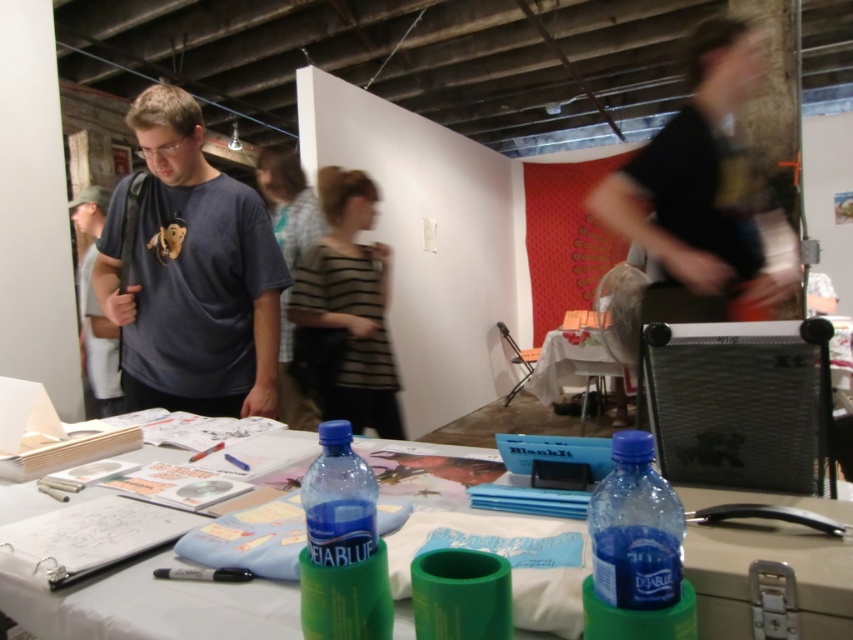
Question: Which point is closer to the camera taking this photo?

Choices:
 (A) (115, 342)
 (B) (538, 356)
 (C) (683, 113)
 (D) (614, 625)

Answer: (D)

Question: Does striped fabric shirt at center lie in front of blue plastic water bottle at center?

Choices:
 (A) yes
 (B) no

Answer: (B)

Question: Is striped fabric shirt at center smaller than blue plastic water bottle at center?

Choices:
 (A) no
 (B) yes

Answer: (A)

Question: Which object is the farthest from the blue translucent bottle at center?

Choices:
 (A) dark gray t-shirt at center
 (B) striped fabric shirt at center
 (C) translucent plastic table at center

Answer: (B)

Question: Does black matte shirt at upper right lie in front of striped fabric shirt at center?

Choices:
 (A) no
 (B) yes

Answer: (B)

Question: Which point is farther from the camera taking this photo?

Choices:
 (A) (82, 330)
 (B) (798, 499)
 (C) (552, 374)
 (D) (328, 534)

Answer: (C)